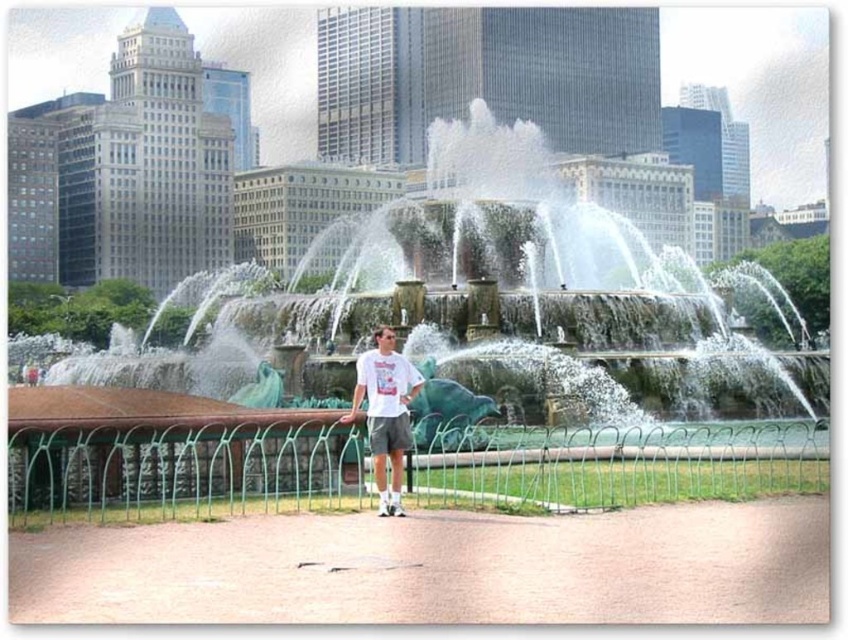
You are a GUI agent. You are given a task and a screenshot of the screen. Output one action in this format:
    pyautogui.click(x=<x>, y=<y>)
    Task: Click on the green patina water at center
    The image size is (848, 640).
    Given the screenshot: What is the action you would take?
    pyautogui.click(x=486, y=305)

The height and width of the screenshot is (640, 848). What do you see at coordinates (486, 305) in the screenshot? I see `green patina water at center` at bounding box center [486, 305].

Image resolution: width=848 pixels, height=640 pixels. What are the coordinates of `green patina water at center` in the screenshot? It's located at (486, 305).